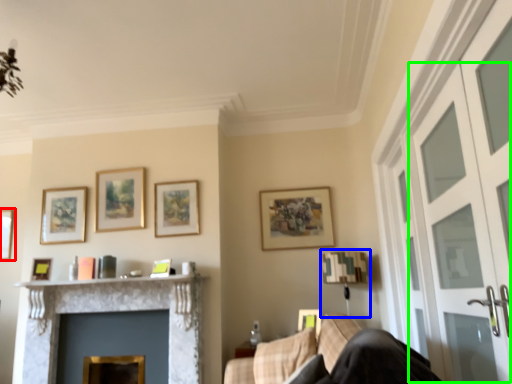
Question: Which object is the closest to the picture frame (highlighted by a red box)? Choose among these: lamp (highlighted by a blue box) or screen door (highlighted by a green box).

Choices:
 (A) lamp
 (B) screen door

Answer: (A)